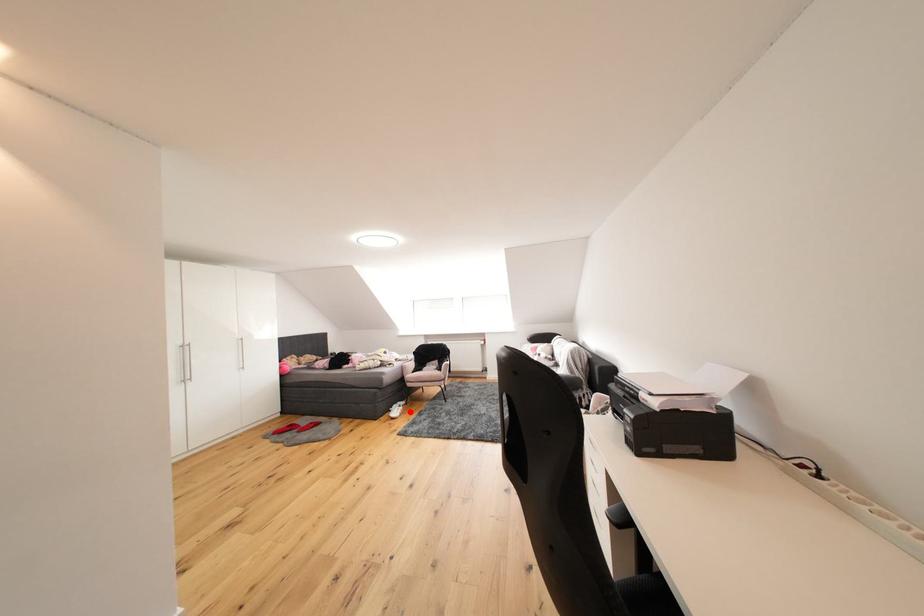
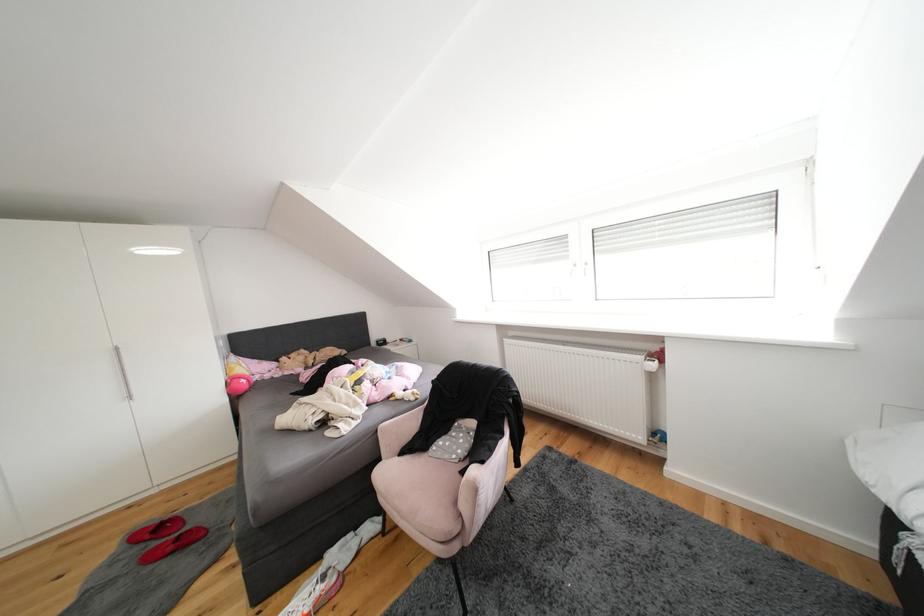
Question: I am providing you with two images of the same scene from different viewpoints. In image1, a red point is highlighted. Considering the same 3D point in image2, which of the following is correct?

Choices:
 (A) It is closer
 (B) It is farther

Answer: (B)